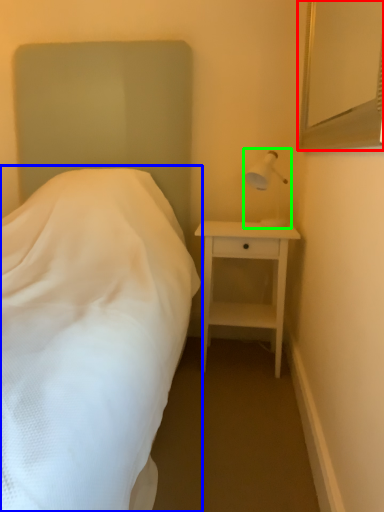
Question: Based on their relative distances, which object is farther from mirror (highlighted by a red box)? Choose from bed (highlighted by a blue box) and bedside lamp (highlighted by a green box).

Choices:
 (A) bed
 (B) bedside lamp

Answer: (A)